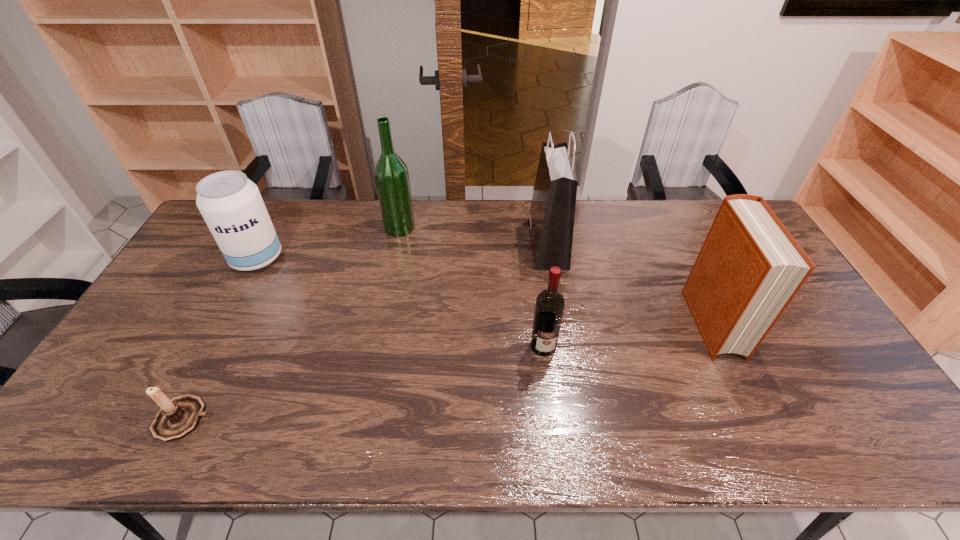
The width and height of the screenshot is (960, 540). In order to click on free space located 0.390m on the front with handles of the shopping bag in this screenshot , I will do `click(416, 244)`.

In order to click on vacant space located 0.400m on the front with handles of the shopping bag in this screenshot , I will do `click(413, 244)`.

Identify the location of blank area located 0.060m on the open cover of the hardback book. (739, 381).

Image resolution: width=960 pixels, height=540 pixels. In order to click on free space located 0.220m on the right of the second farthest alcohol in this screenshot , I will do `click(349, 259)`.

What are the coordinates of `vacant space located 0.190m on the front and back of the rightmost alcohol` in the screenshot? It's located at (553, 425).

Locate an element on the screen. vacant position located on the left of the candle holder is located at coordinates (86, 419).

Find the location of a particular element. Image resolution: width=960 pixels, height=540 pixels. shopping bag located in the far edge section of the desktop is located at coordinates (551, 218).

At what (x,y) coordinates should I click in order to perform the action: click on object present at the near edge. Please return your answer as a coordinate pair (x, y). Looking at the image, I should click on (178, 417).

This screenshot has height=540, width=960. Find the location of `object at the left edge`. object at the left edge is located at coordinates (231, 205).

Where is `object present at the far left corner`? object present at the far left corner is located at coordinates (231, 205).